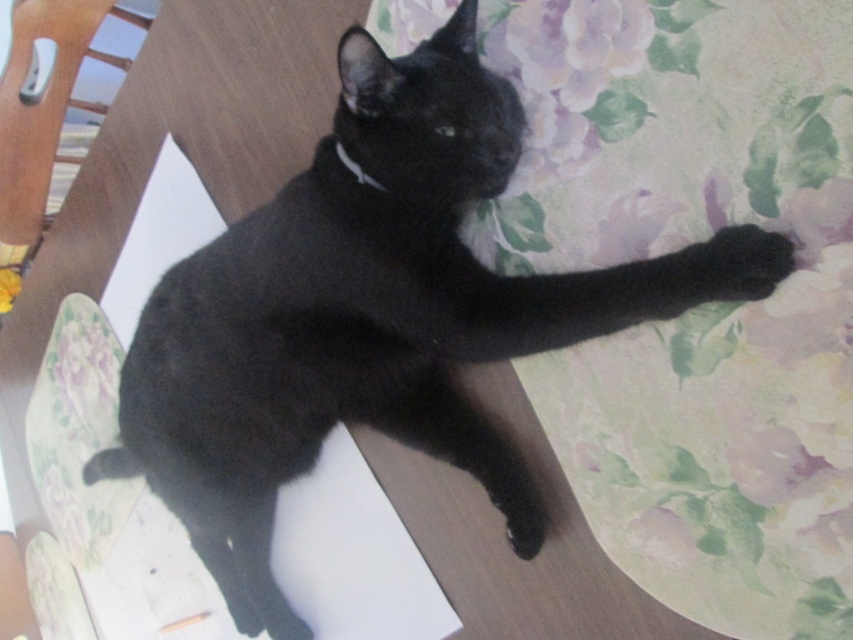
You are standing in front of a floral patterned surface where a black cat is lying. There is a specific point at coordinates point (775, 241). If you want to place a small toy 1 meter away from yourself towards that point, will the toy land on the floral patterned surface?

The point (775, 241) is 97.33 centimeters away from the viewer. Since 97.33 cm is less than 1 meter, placing the toy 1 meter away would go beyond that point and not land on the floral patterned surface.

You are a photographer trying to capture the black cat in the image. You need to ensure that the black fuzzy paw at upper right and the silvery metallic collar at upper center are both clearly visible in your shot. Considering their positions, which object will appear larger in the photo?

The black fuzzy paw at upper right will appear larger in the photo because it is taller than the silvery metallic collar at upper center.

You are a photographer trying to capture the black fuzzy paw at upper right and the silvery metallic collar at upper center in a closeup shot. Which object should you zoom in on to ensure it fills more of the frame without moving the camera?

The black fuzzy paw at upper right should be zoomed in on because its width is larger than the silvery metallic collar at upper center, allowing it to fill more of the frame when magnified.